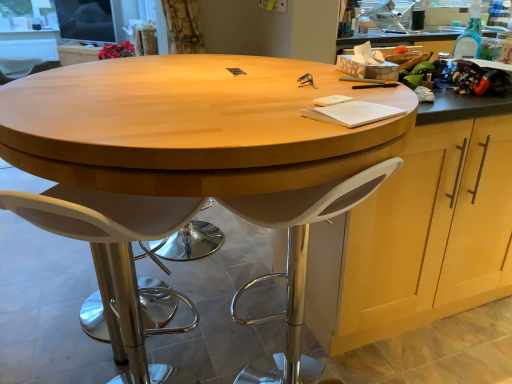
Question: In the image, is white plastic stool at center positioned in front of or behind white plastic chair at left, positioned as the second chair in right-to-left order?

Choices:
 (A) front
 (B) behind

Answer: (A)

Question: Is white plastic stool at center inside the boundaries of white plastic chair at left, positioned as the 1th chair in back-to-front order, or outside?

Choices:
 (A) inside
 (B) outside

Answer: (B)

Question: Which object is positioned farthest from the wooden cabinet at right, which is the first cabinetry from right to left?

Choices:
 (A) white plastic stool at center
 (B) white plastic chair at left, positioned as the second chair in right-to-left order
 (C) white plastic stool at lower left, which is counted as the 2th chair, starting from the back
 (D) transparent glass bottle at upper right
 (E) light wood cabinet at upper center, the 2th cabinetry in the front-to-back sequence

Answer: (E)

Question: Which is nearer to the light wood cabinet at upper center, arranged as the 1th cabinetry when viewed from the top?

Choices:
 (A) white plastic chair at left, the 2th chair positioned from the front
 (B) curtaintextured fabric at upper left
 (C) wooden cabinet at right, which is the 2th cabinetry from left to right
 (D) transparent glass bottle at upper right
 (E) white plastic stool at center

Answer: (A)